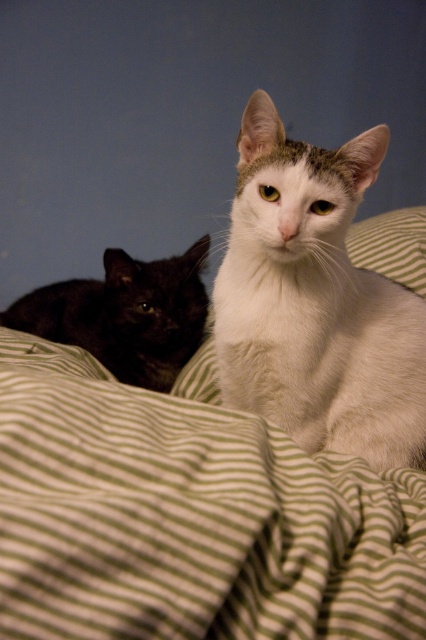
You are a photographer trying to capture a clear photo of the black glossy cat at left and the green striped pillow at center. Which object is closer to the camera, and will it appear larger in the photo?

The black glossy cat at left is closer to the camera than the green striped pillow at center, so it will appear larger in the photo.

You are trying to decide whether to place a new toy on the bed where the green striped blanket at center and the white fluffy cat at center are. The toy requires a space wider than the cat. Can the blanket provide enough width for the toy?

The green striped blanket at center has a width larger than the white fluffy cat at center, so the blanket can accommodate the toy needing space wider than the cat.

Based on the photo, you are trying to locate the white fluffy cat at center in the image. The coordinates given are in a normalized system where the bottom left corner is the origin. What direction should you move from the point at coordinates point (316, 301) to find the white fluffy cat at center?

The point at coordinates point (316, 301) already marks the white fluffy cat at center, so you don not need to move in any direction.